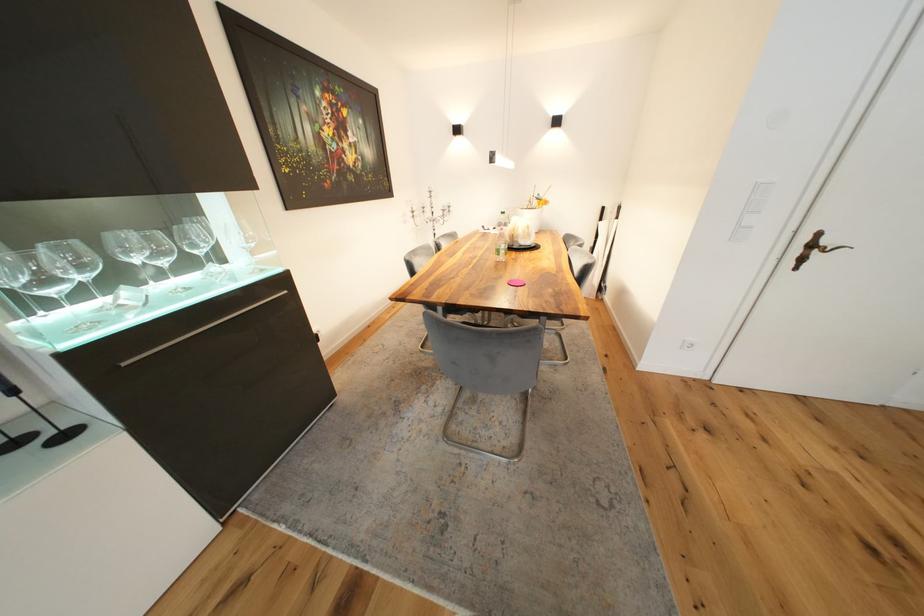
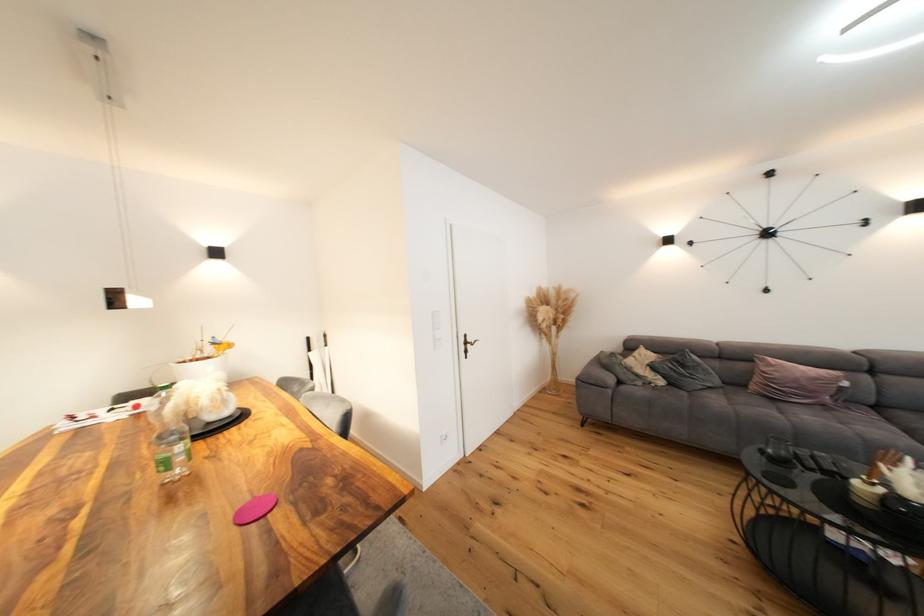
Where in the second image is the point corresponding to the point at 505,256 from the first image?

(176, 469)